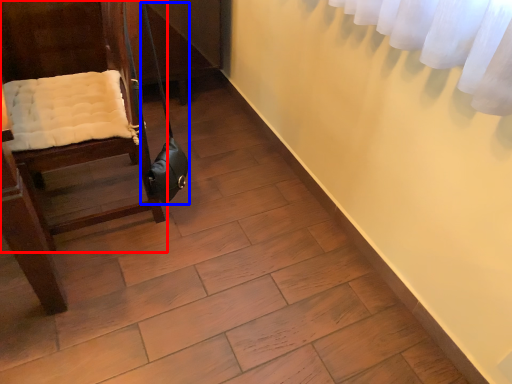
Question: Which point is closer to the camera, furniture (highlighted by a red box) or shoulder bag (highlighted by a blue box)?

Choices:
 (A) furniture
 (B) shoulder bag

Answer: (A)